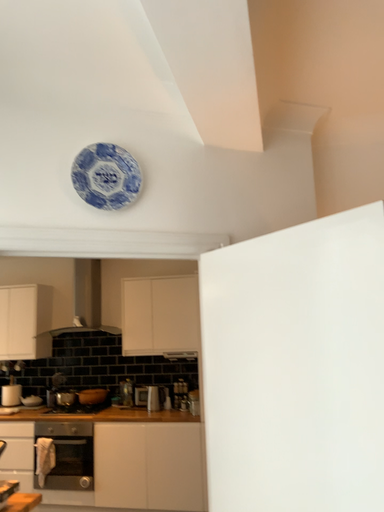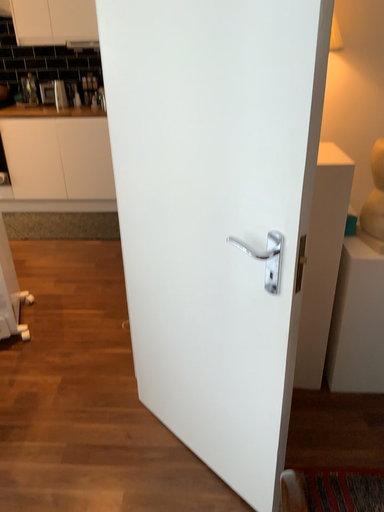
Question: Which way did the camera rotate in the video?

Choices:
 (A) rotated left
 (B) rotated right

Answer: (B)